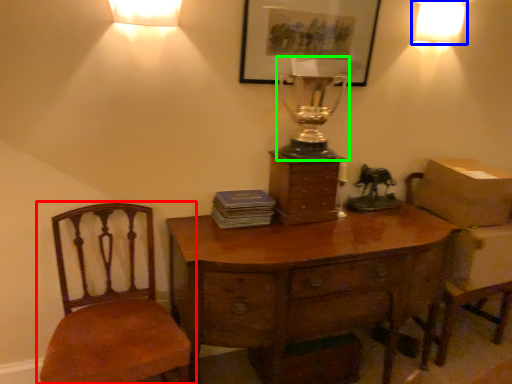
Question: Estimate the real-world distances between objects in this image. Which object is farther from chair (highlighted by a red box), lamp (highlighted by a blue box) or candle holder (highlighted by a green box)?

Choices:
 (A) lamp
 (B) candle holder

Answer: (A)